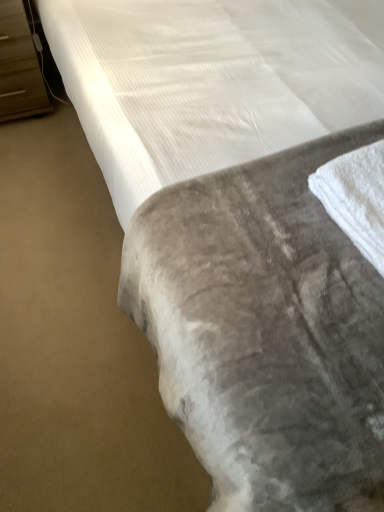
At what (x,y) coordinates should I click in order to perform the action: click on free space in front of brown wood dresser at left. Please return your answer as a coordinate pair (x, y). The width and height of the screenshot is (384, 512). Looking at the image, I should click on (32, 146).